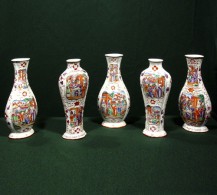
Find any where vase ends and base begins in the image. Your answer should be formatted as a list of tuples, i.e. [(x1, y1), (x2, y2), ...], where each tuple contains the x and y coordinates of a point satisfying the conditions above.

[(193, 126), (157, 131), (118, 122), (71, 134), (22, 132)]